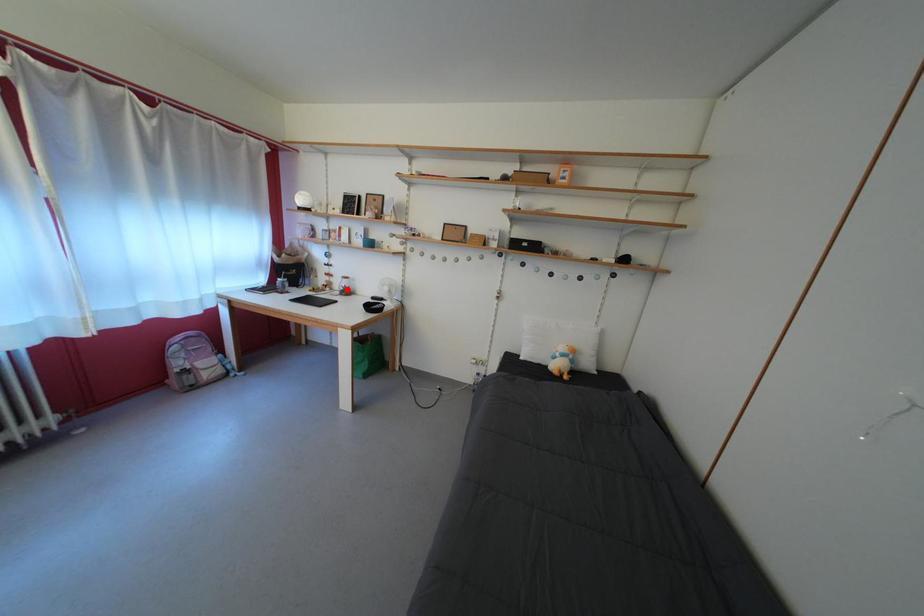
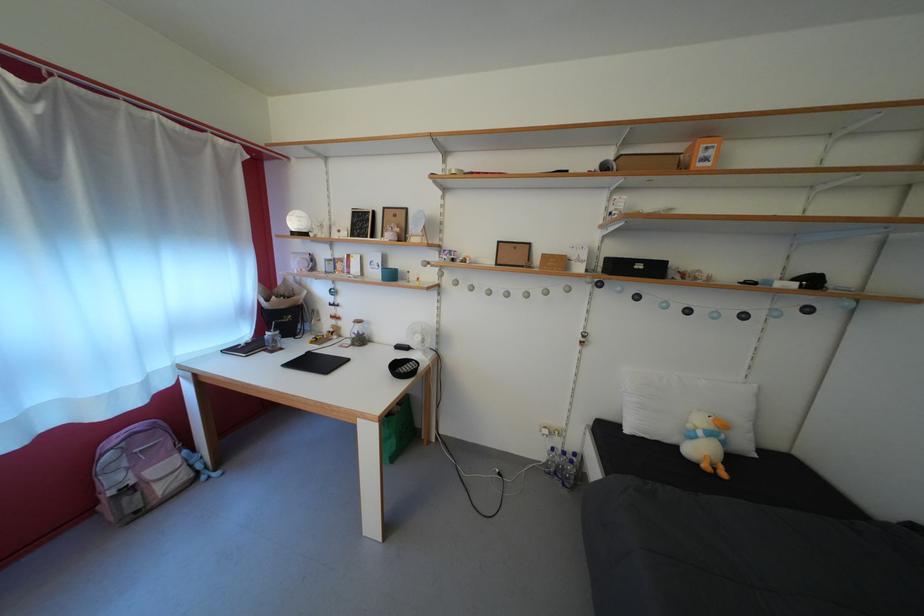
In the second image, find the point that corresponds to the highlighted location in the first image.

(358, 334)